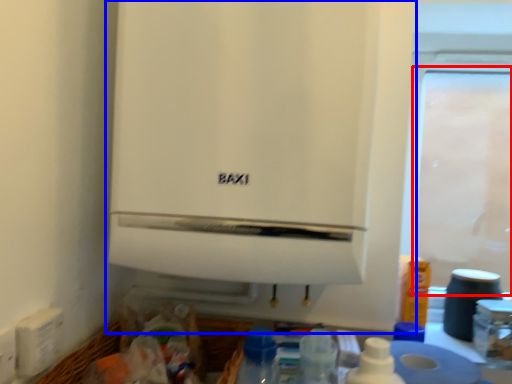
Question: Which object is closer to the camera taking this photo, screen door (highlighted by a red box) or home appliance (highlighted by a blue box)?

Choices:
 (A) screen door
 (B) home appliance

Answer: (B)